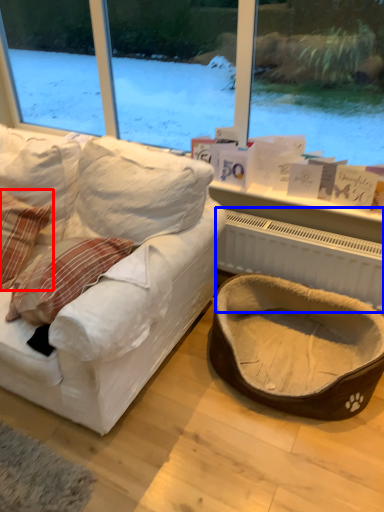
Question: Which point is closer to the camera, pillow (highlighted by a red box) or radiator (highlighted by a blue box)?

Choices:
 (A) pillow
 (B) radiator

Answer: (A)